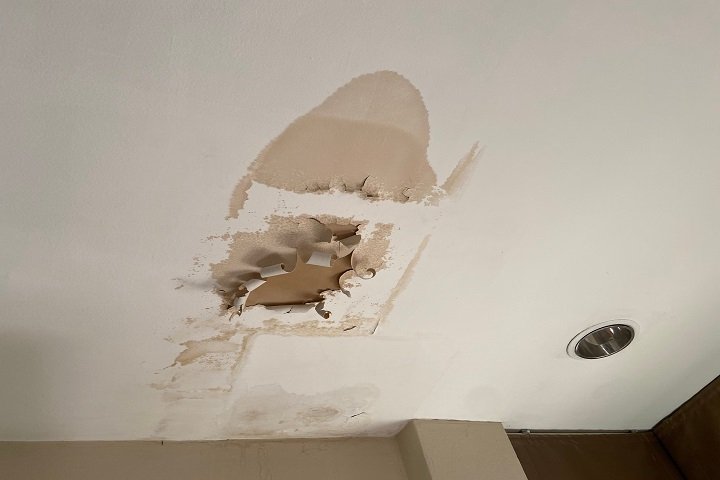
You are a GUI agent. You are given a task and a screenshot of the screen. Output one action in this format:
    pyautogui.click(x=<x>, y=<y>)
    Task: Click on the shadows on white ceiling large
    This screenshot has width=720, height=480.
    Given the screenshot: What is the action you would take?
    pyautogui.click(x=16, y=383)